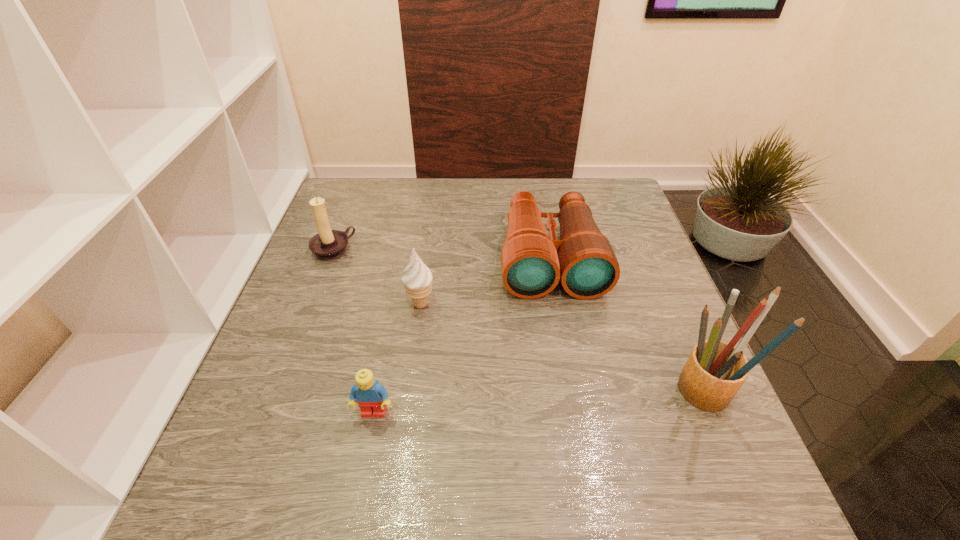
This screenshot has height=540, width=960. What are the coordinates of `vacant space that's between the icecream and the rightmost object` in the screenshot? It's located at (564, 349).

Where is `empty space that is in between the icecream and the second object from right to left`? The width and height of the screenshot is (960, 540). empty space that is in between the icecream and the second object from right to left is located at coordinates (485, 281).

Identify the location of vacant area that lies between the second shortest object and the Lego. This screenshot has height=540, width=960. (462, 335).

The height and width of the screenshot is (540, 960). I want to click on unoccupied position between the rightmost object and the Lego, so click(541, 403).

Identify the location of unoccupied area between the candle holder and the rightmost object. (520, 322).

Identify the location of vacant area that lies between the rightmost object and the leftmost object. The width and height of the screenshot is (960, 540). (520, 322).

The width and height of the screenshot is (960, 540). Find the location of `empty location between the candle holder and the second object from right to left`. empty location between the candle holder and the second object from right to left is located at coordinates (442, 254).

The height and width of the screenshot is (540, 960). What are the coordinates of `vacant area that lies between the fourth tallest object and the icecream` in the screenshot? It's located at (485, 281).

Where is `unoccupied area between the tallest object and the candle holder`? unoccupied area between the tallest object and the candle holder is located at coordinates (520, 322).

Locate an element on the screen. This screenshot has height=540, width=960. the second closest object relative to the icecream is located at coordinates (328, 244).